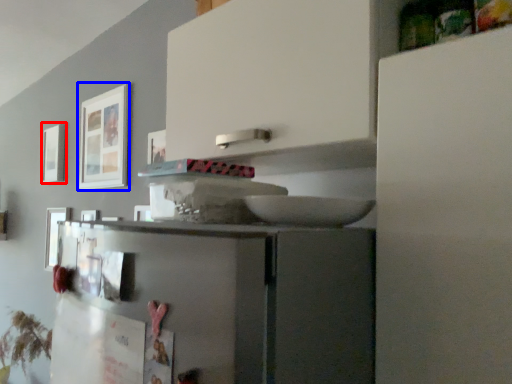
Question: Which point is further to the camera, picture frame (highlighted by a red box) or picture frame (highlighted by a blue box)?

Choices:
 (A) picture frame
 (B) picture frame

Answer: (A)